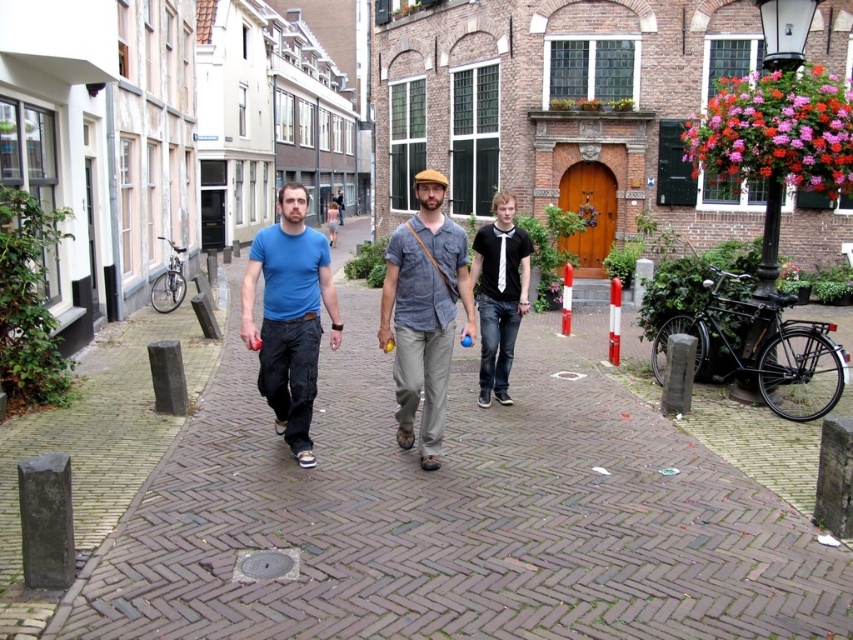
In the scene shown: Can you confirm if denim shirt at center is wider than blue cotton t-shirt at center?

Incorrect, denim shirt at center's width does not surpass blue cotton t-shirt at center's.

Does point (422, 275) lie in front of point (454, 292)?

Yes, it is.

Where is `denim shirt at center`? denim shirt at center is located at coordinates (424, 312).

The image size is (853, 640). What do you see at coordinates (457, 516) in the screenshot? I see `brown brick pavement at center` at bounding box center [457, 516].

How far apart are brown brick pavement at center and blue cotton t-shirt at center?

The distance of brown brick pavement at center from blue cotton t-shirt at center is 7.43 feet.

At what (x,y) coordinates should I click in order to perform the action: click on brown brick pavement at center. Please return your answer as a coordinate pair (x, y). The width and height of the screenshot is (853, 640). Looking at the image, I should click on (457, 516).

Does point (602, 576) lie in front of point (498, 218)?

Yes, point (602, 576) is in front of point (498, 218).

Between brown brick pavement at center and black matte shirt at center, which one is positioned lower?

Positioned lower is brown brick pavement at center.

Identify the location of brown brick pavement at center. Image resolution: width=853 pixels, height=640 pixels. (457, 516).